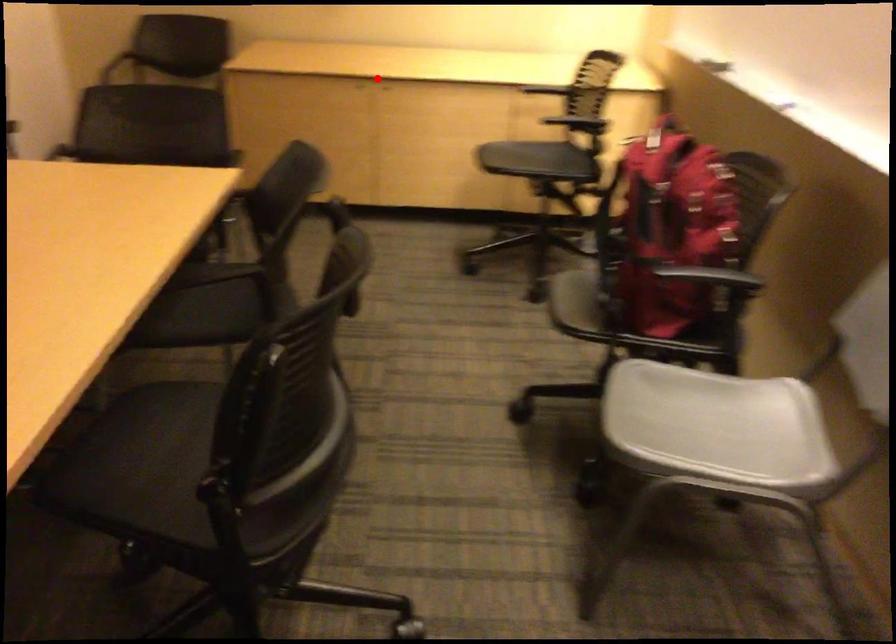
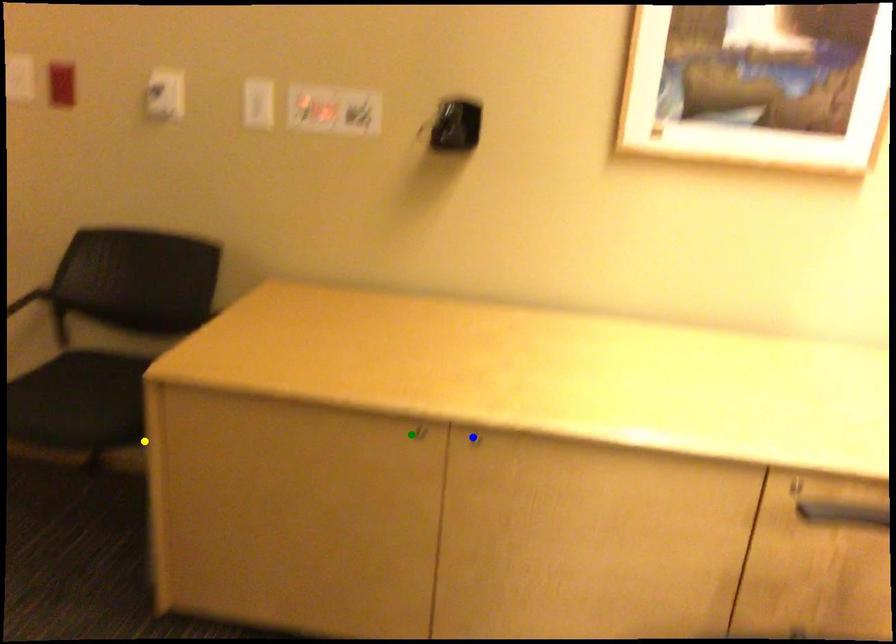
Question: I am providing you with two images of the same scene from different viewpoints. A red point is marked on the first image. You are given multiple points on the second image. Which point in image 2 is actually the same real-world point as the red point in image 1?

Choices:
 (A) blue point
 (B) green point
 (C) yellow point

Answer: (A)